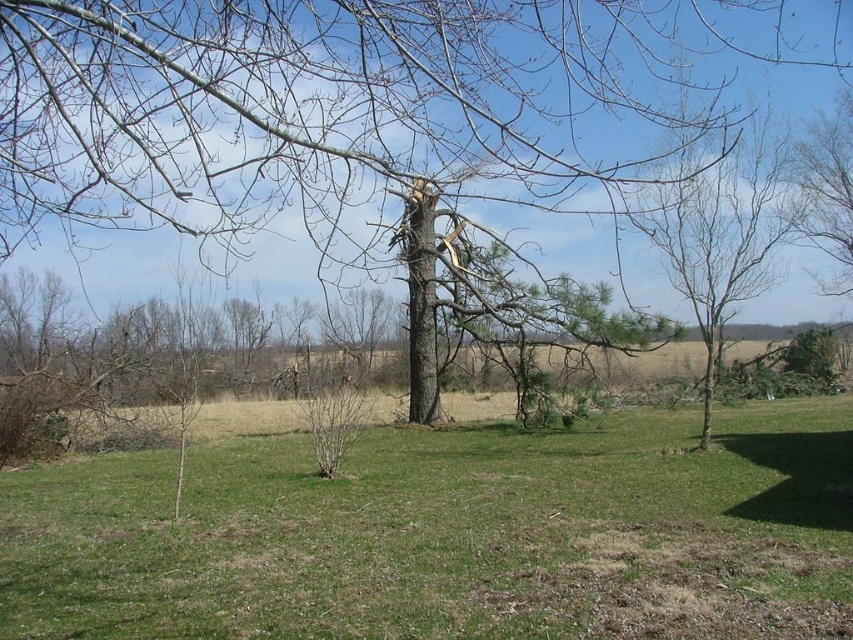
Looking at this image, you are standing at the origin point in the image. Which direction should you move to reach the green grass at center?

The green grass at center is located at point 0.838 in the x direction and 0.528 in the y direction. Since you are at the origin, you should move towards the right and slightly upwards to reach it.

You are a gardener assessing the landscape. You notice the green grass at center and the bare branches at right. Which one has a lower height?

The green grass at center is shorter than the bare branches at right, so the green grass at center has a lower height.

Based on the photo, you are a gardener planning to plant a new flower bed between the green grass at center and the brown rough tree at center. Which side of the tree should you place the flowers to ensure they are on the same side as the green grass?

The green grass at center is positioned on the left side of brown rough tree at center, so you should place the flowers on the left side of the brown rough tree at center to align them with the green grass.